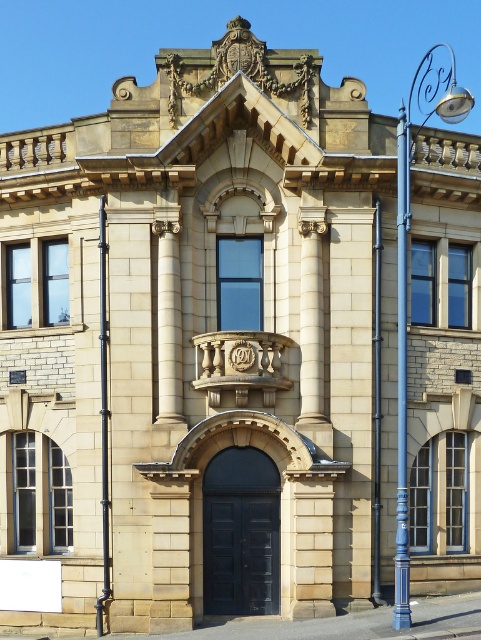
Does point (104, 244) come closer to viewer compared to point (379, 518)?

No, (104, 244) is further to viewer.

The height and width of the screenshot is (640, 481). Find the location of `black pipe at center`. black pipe at center is located at coordinates click(x=103, y=420).

Based on the photo, can you confirm if blue metallic pole at right is thinner than black metal pole at center?

No.

Who is higher up, blue metallic pole at right or black metal pole at center?

Positioned higher is blue metallic pole at right.

This screenshot has width=481, height=640. Identify the location of blue metallic pole at right. (402, 376).

Based on the photo, between blue metallic pole at right and black pipe at center, which one appears on the left side from the viewer's perspective?

black pipe at center

Is blue metallic pole at right shorter than black pipe at center?

Incorrect, blue metallic pole at right's height does not fall short of black pipe at center's.

Is point (408, 211) more distant than point (102, 196)?

No, it is not.

You are a GUI agent. You are given a task and a screenshot of the screen. Output one action in this format:
    pyautogui.click(x=<x>, y=<y>)
    Task: Click on the blue metallic pole at right
    Image resolution: width=481 pixels, height=640 pixels.
    Given the screenshot: What is the action you would take?
    pyautogui.click(x=402, y=376)